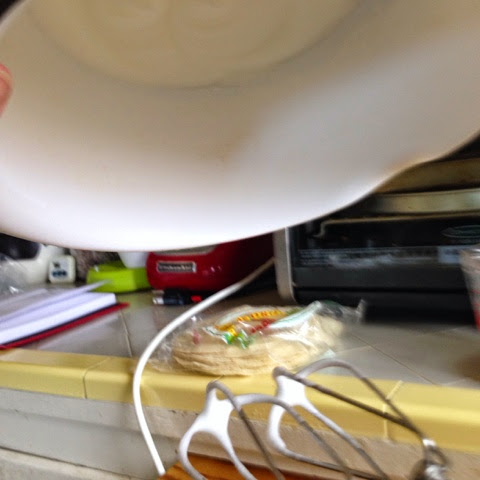
This screenshot has width=480, height=480. I want to click on cord, so click(x=138, y=397).